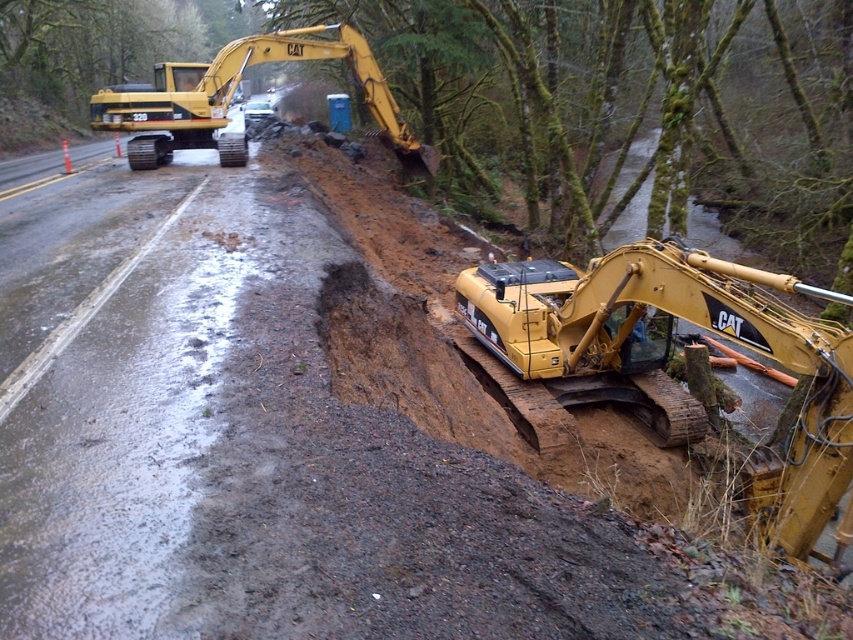
Question: Is yellow metallic excavator at center bigger than yellow metallic excavator at upper left?

Choices:
 (A) yes
 (B) no

Answer: (B)

Question: Which point is farther from the camera taking this photo?

Choices:
 (A) (277, 52)
 (B) (822, 513)

Answer: (A)

Question: Does yellow metallic excavator at center come in front of yellow metallic excavator at upper left?

Choices:
 (A) yes
 (B) no

Answer: (A)

Question: Which of the following is the farthest from the observer?

Choices:
 (A) (265, 61)
 (B) (524, 305)

Answer: (A)

Question: Can you confirm if yellow metallic excavator at center is thinner than yellow metallic excavator at upper left?

Choices:
 (A) no
 (B) yes

Answer: (B)